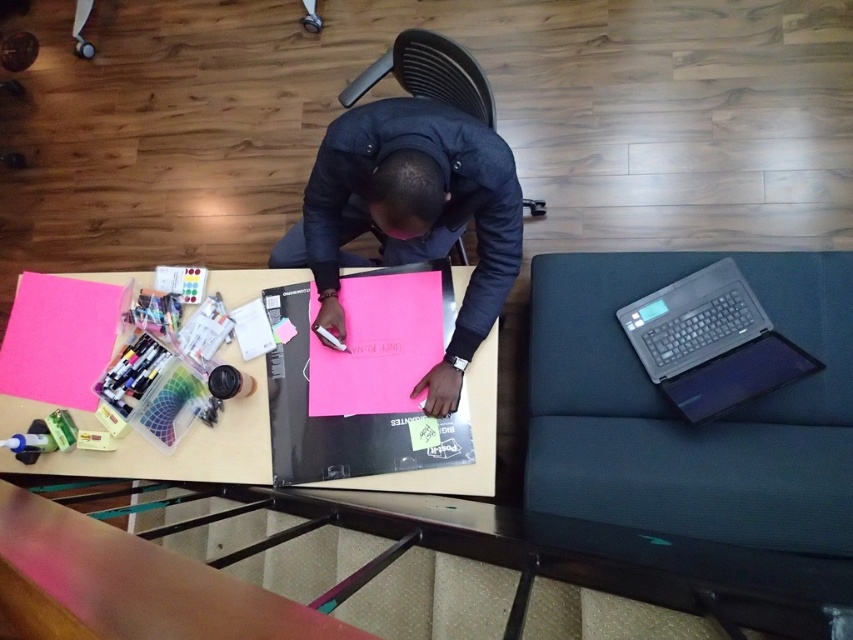
Question: Does pink paper at center appear over black plastic chair at center?

Choices:
 (A) yes
 (B) no

Answer: (B)

Question: Which point is farther to the camera?

Choices:
 (A) (x=462, y=99)
 (B) (x=383, y=232)

Answer: (B)

Question: Is black fabric swivel chair at lower right wider than black plastic chair at center?

Choices:
 (A) no
 (B) yes

Answer: (B)

Question: Among these objects, which one is nearest to the camera?

Choices:
 (A) black fabric swivel chair at lower right
 (B) sleek silver laptop at right
 (C) matte black laptop at center
 (D) pink paper at center

Answer: (A)

Question: Can you confirm if matte black laptop at center is smaller than sleek silver laptop at right?

Choices:
 (A) yes
 (B) no

Answer: (B)

Question: Which point is farther to the camera?

Choices:
 (A) (659, 486)
 (B) (445, 99)
 (C) (755, 324)
 (D) (457, 225)

Answer: (B)